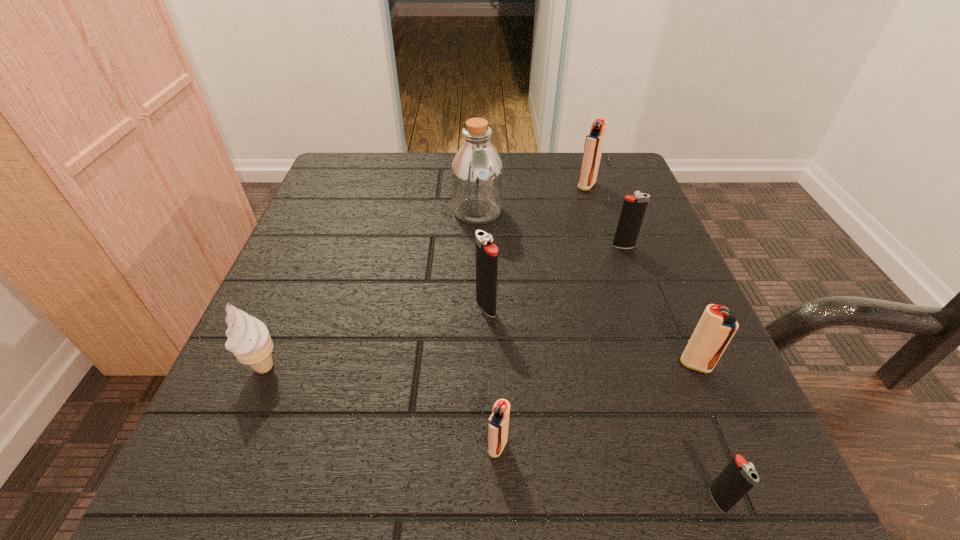
Identify the location of free space located 0.110m on the front of the rightmost igniter. (731, 449).

The image size is (960, 540). What are the coordinates of `vacant region located 0.230m on the right of the nearest red igniter` in the screenshot? It's located at (689, 446).

I want to click on free point located on the back of the nearest black igniter, so click(x=698, y=445).

At what (x,y) coordinates should I click in order to perform the action: click on bottle present at the far edge. Please return your answer as a coordinate pair (x, y). The width and height of the screenshot is (960, 540). Looking at the image, I should click on (477, 175).

Find the location of a particular element. igniter that is at the far edge is located at coordinates coord(594,141).

Where is `object that is at the left edge`? The width and height of the screenshot is (960, 540). object that is at the left edge is located at coordinates (249, 340).

Find the location of `object positioned at the far right corner`. object positioned at the far right corner is located at coordinates (594, 141).

The width and height of the screenshot is (960, 540). Find the location of `object that is at the near right corner`. object that is at the near right corner is located at coordinates (738, 477).

At what (x,y) coordinates should I click in order to perform the action: click on free location at the far edge of the desktop. Please return your answer as a coordinate pair (x, y). The width and height of the screenshot is (960, 540). Looking at the image, I should click on click(448, 165).

Where is `free region at the near edge of the desktop`? The width and height of the screenshot is (960, 540). free region at the near edge of the desktop is located at coordinates (479, 450).